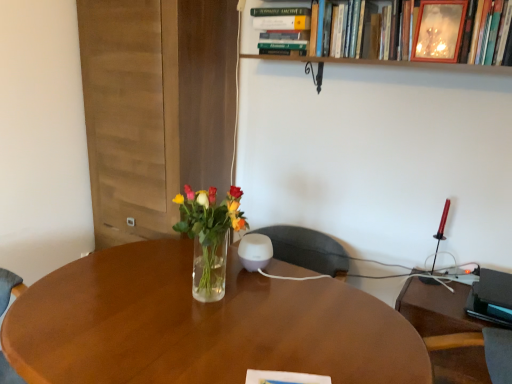
Question: Considering the positions of point tap(475, 360) and point tap(458, 31), is point tap(475, 360) closer or farther from the camera than point tap(458, 31)?

Choices:
 (A) closer
 (B) farther

Answer: (B)

Question: Considering their positions, is black plastic computer desk at right located in front of or behind wooden picture frame at upper right?

Choices:
 (A) front
 (B) behind

Answer: (A)

Question: Considering the real-world distances, which object is closest to the translucent glass vase at center?

Choices:
 (A) wooden picture frame at upper right
 (B) black plastic computer desk at right
 (C) wooden frame at upper center, the first book positioned from the right
 (D) hardcover book at upper center, the second book when ordered from right to left

Answer: (D)

Question: Estimate the real-world distances between objects in this image. Which object is farther from the translucent glass vase at center?

Choices:
 (A) wooden frame at upper center, the second book from the left
 (B) hardcover book at upper center, acting as the 1th book starting from the left
 (C) wooden picture frame at upper right
 (D) black plastic computer desk at right

Answer: (C)